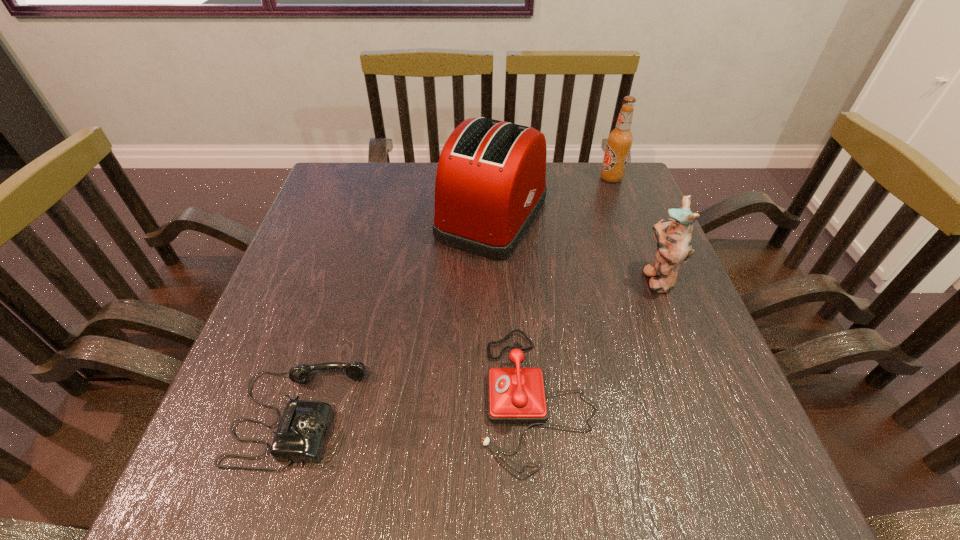
Where is `toaster`? toaster is located at coordinates click(x=490, y=184).

You are a GUI agent. You are given a task and a screenshot of the screen. Output one action in this format:
    pyautogui.click(x=<x>, y=<y>)
    Task: Click on the beer bottle
    
    Given the screenshot: What is the action you would take?
    pyautogui.click(x=619, y=141)

Locate an element on the screen. The width and height of the screenshot is (960, 540). figurine is located at coordinates (673, 238).

Identify the location of the right telephone. This screenshot has height=540, width=960. (515, 395).

Image resolution: width=960 pixels, height=540 pixels. Find the location of `the leftmost object`. the leftmost object is located at coordinates (301, 435).

You are a GUI agent. You are given a task and a screenshot of the screen. Output one action in this format:
    pyautogui.click(x=<x>, y=<y>)
    Task: Click on the vacant region located on the back of the toaster
    This screenshot has height=540, width=960.
    Given the screenshot: What is the action you would take?
    pyautogui.click(x=491, y=162)

Locate an element on the screen. The image size is (960, 540). free space located on the front label of the beer bottle is located at coordinates (467, 178).

In order to click on vacant space positioned on the front label of the beer bottle in this screenshot , I will do `click(575, 178)`.

At what (x,y) coordinates should I click in order to perform the action: click on free location located 0.120m on the front label of the beer bottle. Please return your answer as a coordinate pair (x, y). This screenshot has height=540, width=960. Looking at the image, I should click on (558, 178).

I want to click on free space located 0.370m on the front-facing side of the figurine, so click(x=475, y=278).